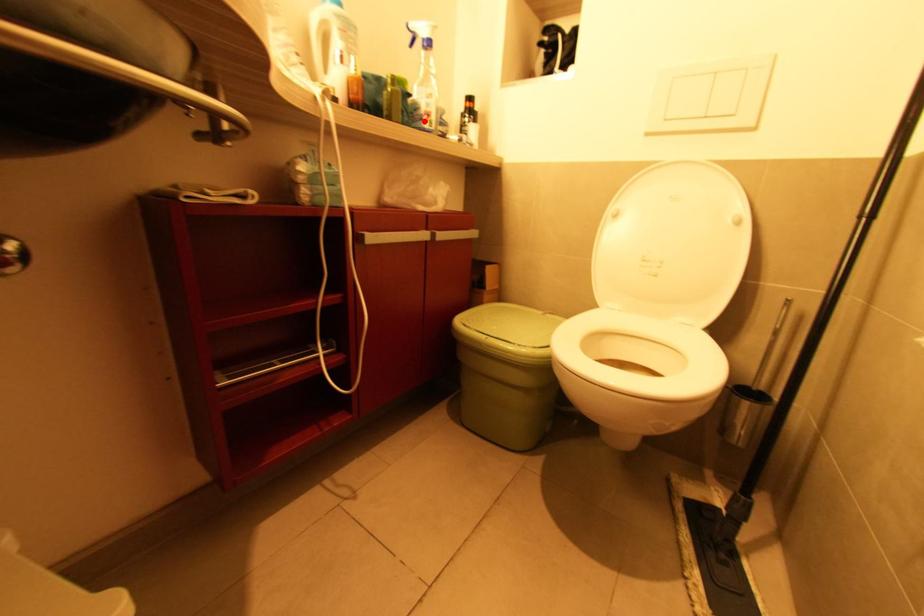
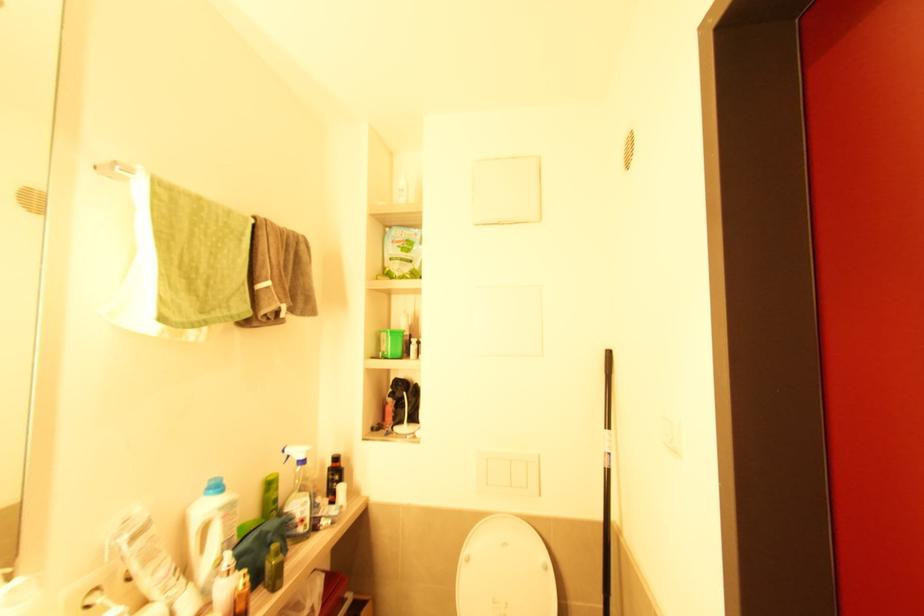
Find the pixel in the second image that matches the highlighted location in the first image.

(298, 527)